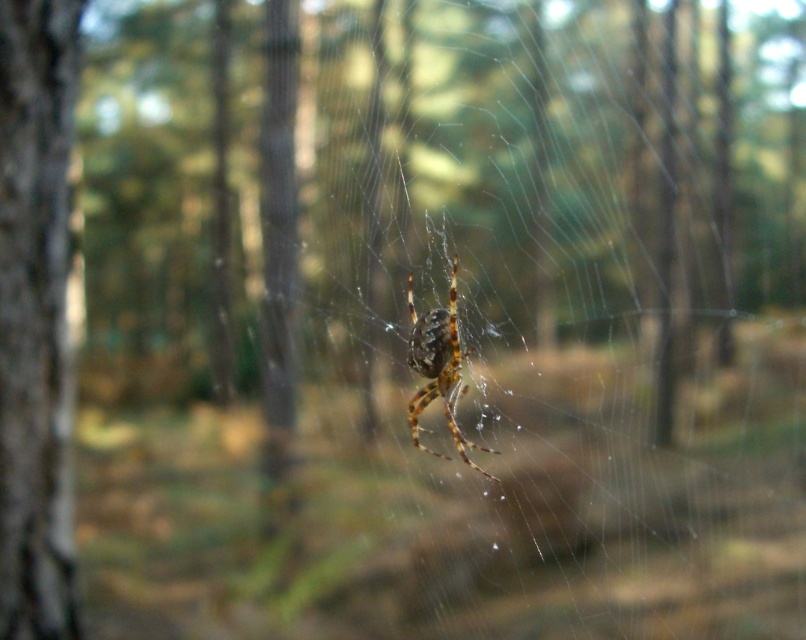
Question: Can you confirm if brown rough bark at left is positioned above brown fuzzy spider at center?

Choices:
 (A) no
 (B) yes

Answer: (B)

Question: Which of the following is the farthest from the observer?

Choices:
 (A) (69, 474)
 (B) (410, 305)

Answer: (B)

Question: Which point is closer to the camera taking this photo?

Choices:
 (A) (13, 88)
 (B) (410, 356)

Answer: (A)

Question: Is brown rough bark at left smaller than brown fuzzy spider at center?

Choices:
 (A) no
 (B) yes

Answer: (B)

Question: Can you confirm if brown rough bark at left is wider than brown fuzzy spider at center?

Choices:
 (A) no
 (B) yes

Answer: (A)